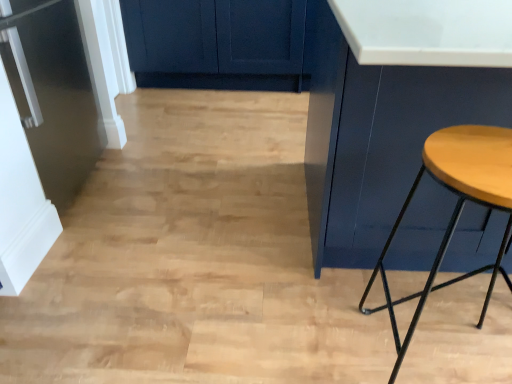
Question: From a real-world perspective, does matte blue cabinet at right stand above satin black refrigerator at left?

Choices:
 (A) no
 (B) yes

Answer: (B)

Question: Is matte blue cabinet at right surrounding satin black refrigerator at left?

Choices:
 (A) yes
 (B) no

Answer: (B)

Question: Is matte blue cabinet at right wider than satin black refrigerator at left?

Choices:
 (A) no
 (B) yes

Answer: (B)

Question: Is matte blue cabinet at right looking in the opposite direction of satin black refrigerator at left?

Choices:
 (A) yes
 (B) no

Answer: (B)

Question: Is matte blue cabinet at right at the left side of satin black refrigerator at left?

Choices:
 (A) yes
 (B) no

Answer: (B)

Question: Could you tell me if matte blue cabinet at right is turned towards satin black refrigerator at left?

Choices:
 (A) yes
 (B) no

Answer: (B)

Question: Is wooden stool at right to the right of matte blue cabinet at right from the viewer's perspective?

Choices:
 (A) yes
 (B) no

Answer: (B)

Question: Is the depth of wooden stool at right less than that of matte blue cabinet at right?

Choices:
 (A) no
 (B) yes

Answer: (B)

Question: Is wooden stool at right looking in the opposite direction of matte blue cabinet at right?

Choices:
 (A) no
 (B) yes

Answer: (B)

Question: Can you confirm if wooden stool at right is smaller than matte blue cabinet at right?

Choices:
 (A) no
 (B) yes

Answer: (B)

Question: From a real-world perspective, is wooden stool at right over matte blue cabinet at right?

Choices:
 (A) yes
 (B) no

Answer: (B)

Question: Could you tell me if wooden stool at right is turned towards matte blue cabinet at right?

Choices:
 (A) no
 (B) yes

Answer: (B)

Question: From a real-world perspective, does matte blue cabinet at right stand above wooden stool at right?

Choices:
 (A) no
 (B) yes

Answer: (B)